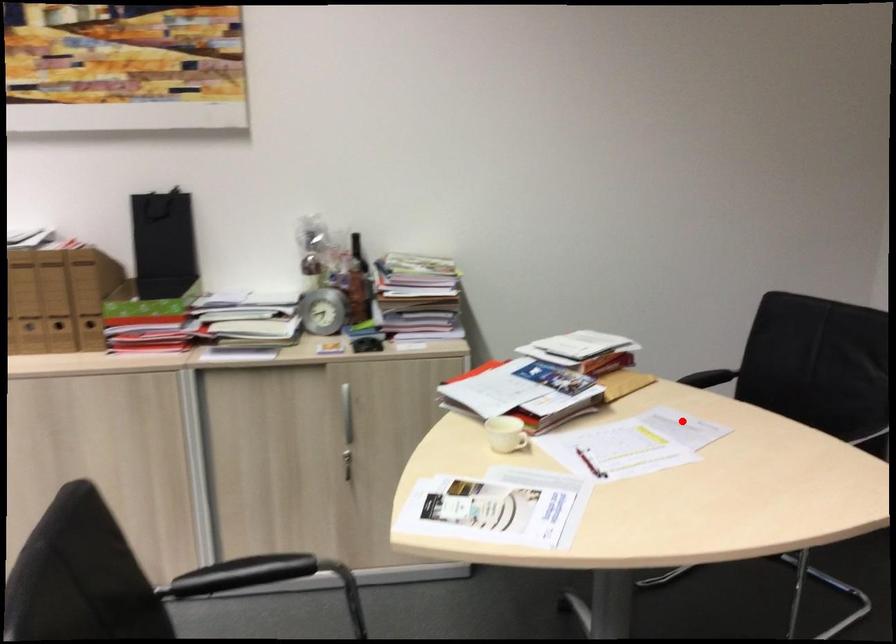
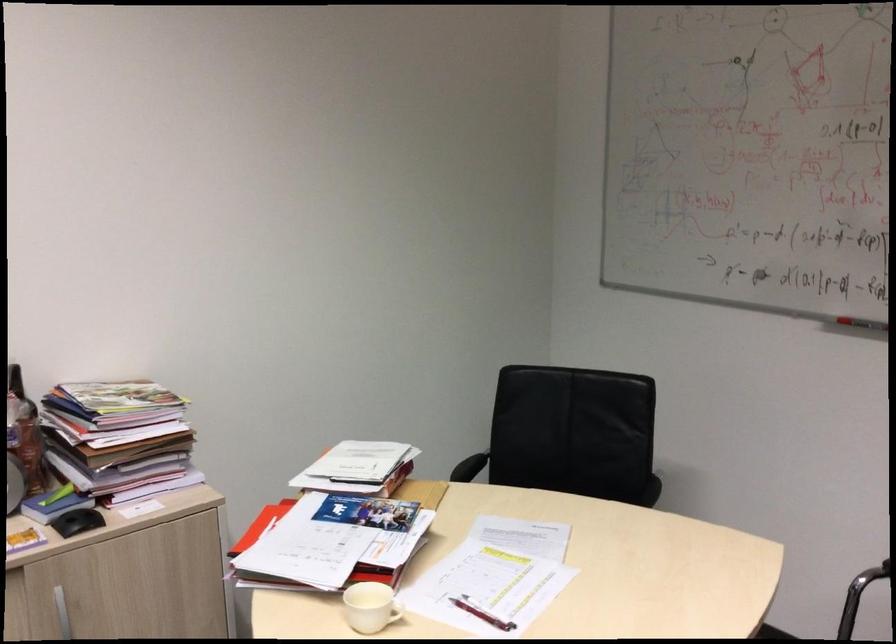
Question: I am providing you with two images of the same scene from different viewpoints. A red point is shown in image1. For the corresponding object point in image2, is it positioned nearer or farther from the camera?

Choices:
 (A) Nearer
 (B) Farther

Answer: (A)